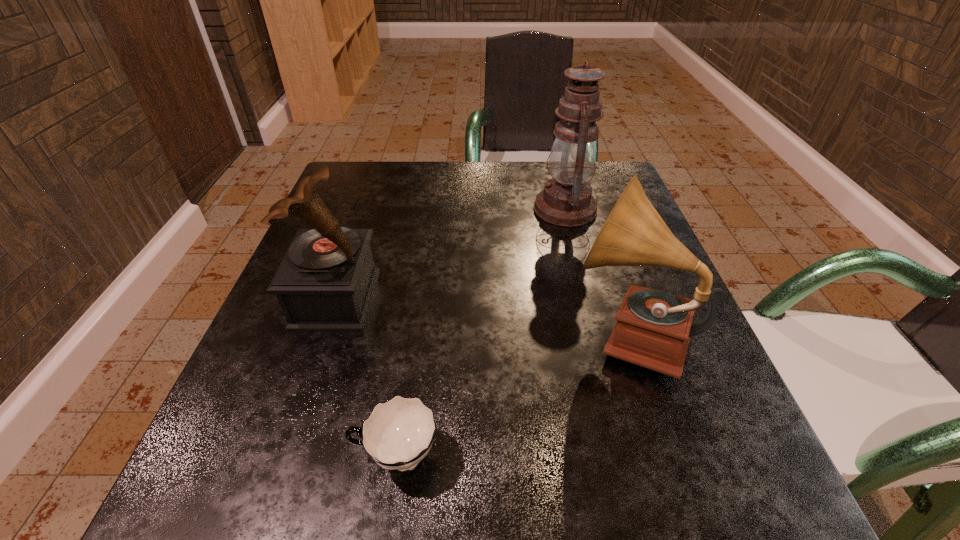
Identify the location of vacant region located 0.230m at the horn opening of the left phonograph_record. The height and width of the screenshot is (540, 960). (505, 299).

The width and height of the screenshot is (960, 540). What are the coordinates of `vacant space located on the side of the nearest object with the handle` in the screenshot? It's located at (234, 457).

Image resolution: width=960 pixels, height=540 pixels. Find the location of `free space located 0.190m on the side of the nearest object with the handle`. free space located 0.190m on the side of the nearest object with the handle is located at coordinates (203, 457).

Image resolution: width=960 pixels, height=540 pixels. Find the location of `free space located on the side of the nearest object with the handle`. free space located on the side of the nearest object with the handle is located at coordinates (258, 457).

You are a GUI agent. You are given a task and a screenshot of the screen. Output one action in this format:
    pyautogui.click(x=<x>, y=<y>)
    Task: Click on the object at the far edge
    The height and width of the screenshot is (540, 960).
    Given the screenshot: What is the action you would take?
    pyautogui.click(x=566, y=201)

Image resolution: width=960 pixels, height=540 pixels. Find the location of `object at the near edge`. object at the near edge is located at coordinates (398, 434).

In order to click on object at the left edge in this screenshot , I will do `click(325, 282)`.

Locate an element on the screen. The width and height of the screenshot is (960, 540). oil lamp at the right edge is located at coordinates (566, 201).

At what (x,y) coordinates should I click in order to perform the action: click on phonograph record at the right edge. Please return your answer as a coordinate pair (x, y). The width and height of the screenshot is (960, 540). Looking at the image, I should click on (653, 329).

Image resolution: width=960 pixels, height=540 pixels. In order to click on object present at the far right corner in this screenshot , I will do `click(566, 201)`.